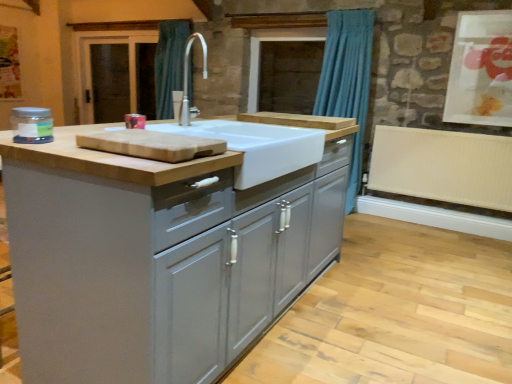
Question: Is white ceramic sink at center facing towards matte paper artwork at upper right?

Choices:
 (A) yes
 (B) no

Answer: (B)

Question: Are white ceramic sink at center and matte paper artwork at upper right beside each other?

Choices:
 (A) no
 (B) yes

Answer: (A)

Question: Is white ceramic sink at center completely or partially outside of matte paper artwork at upper right?

Choices:
 (A) no
 (B) yes

Answer: (B)

Question: Is white ceramic sink at center positioned before matte paper artwork at upper right?

Choices:
 (A) no
 (B) yes

Answer: (B)

Question: Could matte paper artwork at upper right be considered to be inside white ceramic sink at center?

Choices:
 (A) no
 (B) yes

Answer: (A)

Question: Is white ceramic sink at center bigger than matte paper artwork at upper right?

Choices:
 (A) yes
 (B) no

Answer: (A)

Question: Is the position of brown wooden screen door at left more distant than that of matte gray cabinets at center?

Choices:
 (A) yes
 (B) no

Answer: (A)

Question: Does brown wooden screen door at left appear on the left side of matte gray cabinets at center?

Choices:
 (A) yes
 (B) no

Answer: (A)

Question: Would you consider brown wooden screen door at left to be distant from matte gray cabinets at center?

Choices:
 (A) yes
 (B) no

Answer: (A)

Question: Does brown wooden screen door at left lie in front of matte gray cabinets at center?

Choices:
 (A) yes
 (B) no

Answer: (B)

Question: Is brown wooden screen door at left smaller than matte gray cabinets at center?

Choices:
 (A) no
 (B) yes

Answer: (B)

Question: From a real-world perspective, is brown wooden screen door at left on matte gray cabinets at center?

Choices:
 (A) no
 (B) yes

Answer: (B)

Question: Can you confirm if white ribbed radiator at lower right is shorter than brown wooden screen door at left?

Choices:
 (A) no
 (B) yes

Answer: (B)